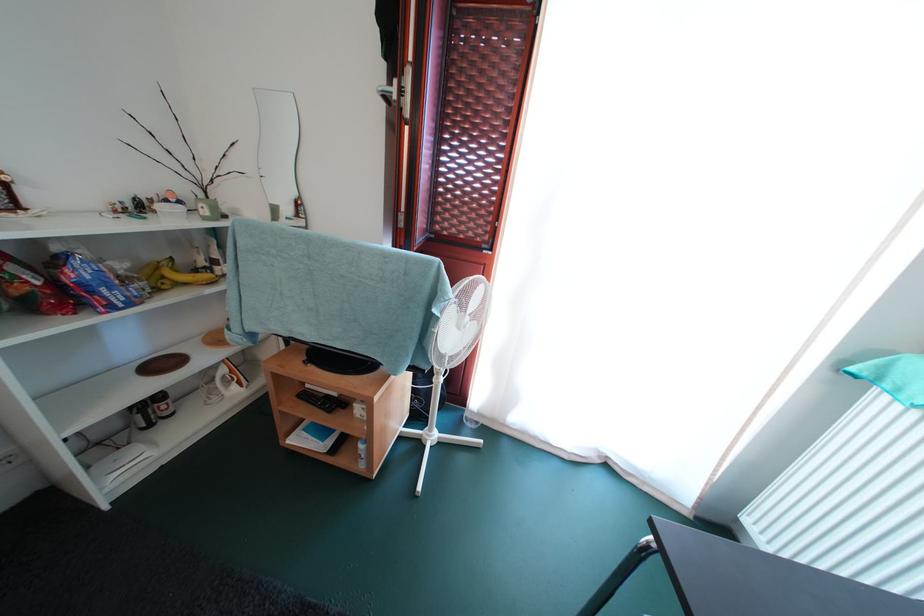
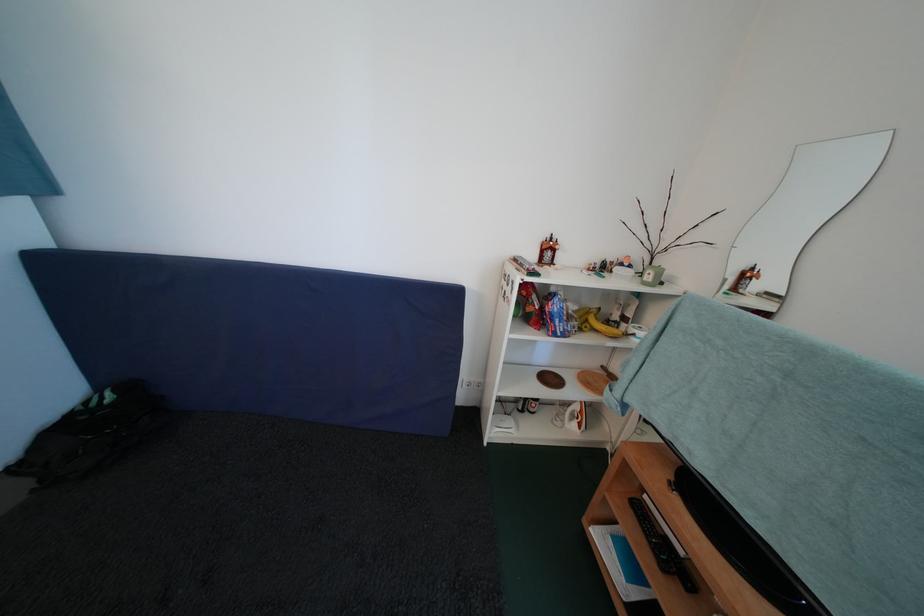
Question: The camera is either moving clockwise (left) or counter-clockwise (right) around the object. The first image is from the beginning of the video and the second image is from the end. Is the camera moving left or right when shooting the video?

Choices:
 (A) Left
 (B) Right

Answer: (B)